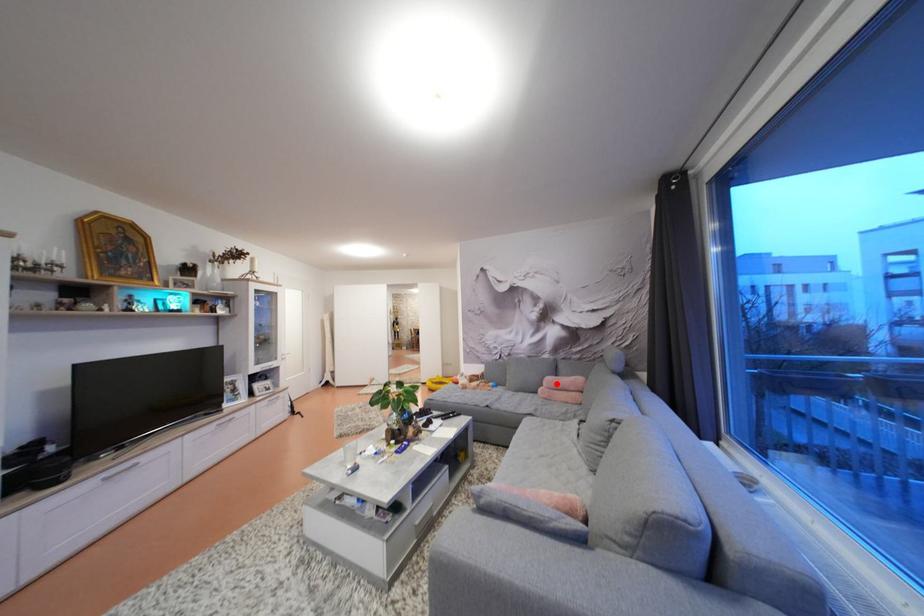
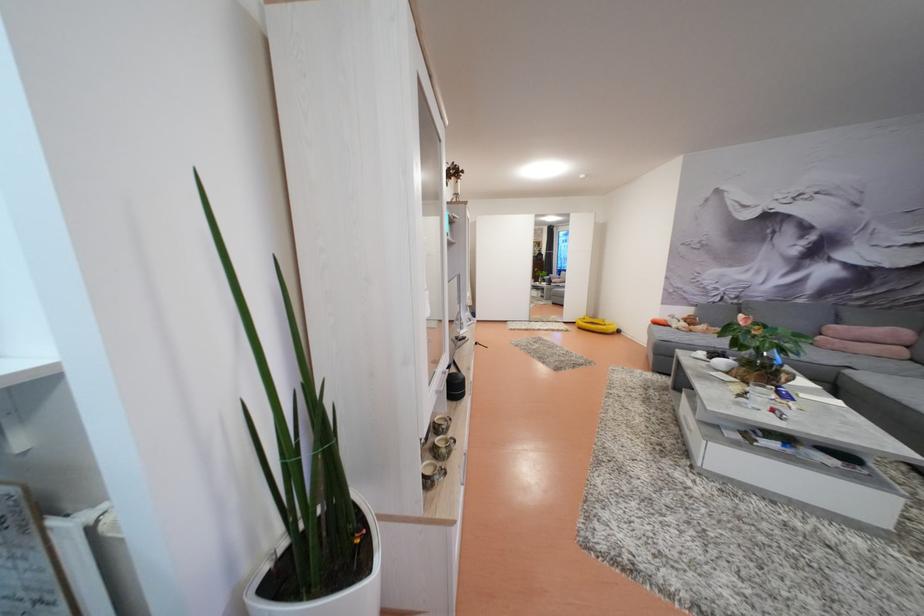
The point at the highlighted location is marked in the first image. Where is the corresponding point in the second image?

(841, 333)